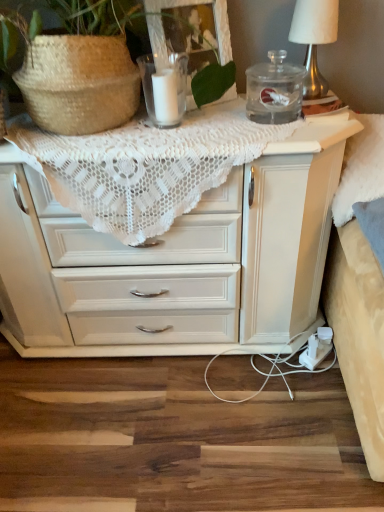
What is the approximate width of white fabric-covered lampshade at upper right?

white fabric-covered lampshade at upper right is 5.97 inches wide.

The image size is (384, 512). Identify the location of clear glass candle at upper center. (164, 89).

Which of these two, transparent glass jar at upper right or white fabric-covered lampshade at upper right, is bigger?

With larger size is white fabric-covered lampshade at upper right.

From a real-world perspective, is transparent glass jar at upper right physically located above or below white fabric-covered lampshade at upper right?

transparent glass jar at upper right is below white fabric-covered lampshade at upper right.

Does transparent glass jar at upper right appear on the right side of white fabric-covered lampshade at upper right?

No.

Is point (157, 106) farther from camera compared to point (309, 79)?

No.

From a real-world perspective, between clear glass candle at upper center and white fabric-covered lampshade at upper right, who is vertically higher?

white fabric-covered lampshade at upper right.

Does clear glass candle at upper center turn towards white fabric-covered lampshade at upper right?

No, clear glass candle at upper center is not turned towards white fabric-covered lampshade at upper right.

Considering the sizes of clear glass candle at upper center and white fabric-covered lampshade at upper right in the image, is clear glass candle at upper center bigger or smaller than white fabric-covered lampshade at upper right?

Clearly, clear glass candle at upper center is smaller in size than white fabric-covered lampshade at upper right.

Considering the relative positions of white fabric-covered lampshade at upper right and clear glass candle at upper center in the image provided, is white fabric-covered lampshade at upper right to the left or to the right of clear glass candle at upper center?

From the image, it's evident that white fabric-covered lampshade at upper right is to the right of clear glass candle at upper center.

From the image's perspective, who appears lower, white fabric-covered lampshade at upper right or clear glass candle at upper center?

clear glass candle at upper center appears lower in the image.

In the scene shown: Relative to clear glass candle at upper center, is white fabric-covered lampshade at upper right in front or behind?

white fabric-covered lampshade at upper right is behind clear glass candle at upper center.

From a real-world perspective, is white fabric-covered lampshade at upper right positioned above or below clear glass candle at upper center?

From a real-world perspective, white fabric-covered lampshade at upper right is physically above clear glass candle at upper center.

Would you say white lace doily at upper center is inside or outside transparent glass jar at upper right?

white lace doily at upper center exists outside the volume of transparent glass jar at upper right.

Is white lace doily at upper center wider than transparent glass jar at upper right?

Yes, white lace doily at upper center is wider than transparent glass jar at upper right.

Which point is more forward, (317, 161) or (264, 98)?

The point (317, 161) is closer.

Is white lace doily at upper center touching transparent glass jar at upper right?

No, white lace doily at upper center is not making contact with transparent glass jar at upper right.

Does white fabric-covered lampshade at upper right touch white lace doily at upper center?

No, white fabric-covered lampshade at upper right is not next to white lace doily at upper center.

Is white fabric-covered lampshade at upper right oriented away from white lace doily at upper center?

That's not correct — white fabric-covered lampshade at upper right is not looking away from white lace doily at upper center.

Between white fabric-covered lampshade at upper right and white lace doily at upper center, which one has more height?

With more height is white lace doily at upper center.

From the picture: Is white fabric-covered lampshade at upper right in front of or behind white lace doily at upper center in the image?

white fabric-covered lampshade at upper right is behind white lace doily at upper center.

From a real-world perspective, which is physically below, transparent glass jar at upper right or clear glass candle at upper center?

From a 3D spatial view, transparent glass jar at upper right is below.

This screenshot has width=384, height=512. In order to click on candle holder in front of the transparent glass jar at upper right in this screenshot , I will do `click(164, 89)`.

Is transparent glass jar at upper right positioned beyond the bounds of clear glass candle at upper center?

Yes, transparent glass jar at upper right is not within clear glass candle at upper center.

Can you tell me how much transparent glass jar at upper right and clear glass candle at upper center differ in facing direction?

The angular difference between transparent glass jar at upper right and clear glass candle at upper center is 0.00127 degrees.

Who is shorter, clear glass candle at upper center or transparent glass jar at upper right?

Standing shorter between the two is transparent glass jar at upper right.

Would you say clear glass candle at upper center contains transparent glass jar at upper right?

Actually, transparent glass jar at upper right is outside clear glass candle at upper center.

Are clear glass candle at upper center and transparent glass jar at upper right located far from each other?

They are positioned close to each other.

Considering the positions of objects clear glass candle at upper center and transparent glass jar at upper right in the image provided, who is more to the right, clear glass candle at upper center or transparent glass jar at upper right?

Positioned to the right is transparent glass jar at upper right.

I want to click on table lamp positioned vertically above the transparent glass jar at upper right (from a real-world perspective), so click(x=314, y=39).

The height and width of the screenshot is (512, 384). I want to click on candle holder in front of the white fabric-covered lampshade at upper right, so click(164, 89).

When comparing their distances from white lace doily at upper center, does clear glass candle at upper center or transparent glass jar at upper right seem further?

clear glass candle at upper center is positioned further to the anchor white lace doily at upper center.

From the picture: From the image, which object appears to be farther from clear glass candle at upper center, white fabric-covered lampshade at upper right or white lace doily at upper center?

The object further to clear glass candle at upper center is white lace doily at upper center.

Looking at the image, which one is located closer to white fabric-covered lampshade at upper right, clear glass candle at upper center or transparent glass jar at upper right?

transparent glass jar at upper right is positioned closer to the anchor white fabric-covered lampshade at upper right.

From the image, which object appears to be nearer to transparent glass jar at upper right, white lace doily at upper center or clear glass candle at upper center?

clear glass candle at upper center.

Looking at the image, which one is located closer to white lace doily at upper center, white fabric-covered lampshade at upper right or transparent glass jar at upper right?

The object closer to white lace doily at upper center is transparent glass jar at upper right.

Looking at the image, which one is located closer to transparent glass jar at upper right, white fabric-covered lampshade at upper right or white lace doily at upper center?

The object closer to transparent glass jar at upper right is white fabric-covered lampshade at upper right.

Based on their spatial positions, is white lace doily at upper center or white fabric-covered lampshade at upper right further from transparent glass jar at upper right?

white lace doily at upper center.

Which object lies further to the anchor point clear glass candle at upper center, transparent glass jar at upper right or white lace doily at upper center?

The object further to clear glass candle at upper center is white lace doily at upper center.

Locate an element on the screen. This screenshot has height=512, width=384. candle holder situated between white lace doily at upper center and transparent glass jar at upper right from left to right is located at coordinates (164, 89).

Where is `glass jar between white lace doily at upper center and white fabric-covered lampshade at upper right in the horizontal direction`? glass jar between white lace doily at upper center and white fabric-covered lampshade at upper right in the horizontal direction is located at coordinates (274, 90).

This screenshot has height=512, width=384. I want to click on candle holder between white lace doily at upper center and white fabric-covered lampshade at upper right, so click(164, 89).

Identify the location of glass jar between clear glass candle at upper center and white fabric-covered lampshade at upper right. point(274,90).